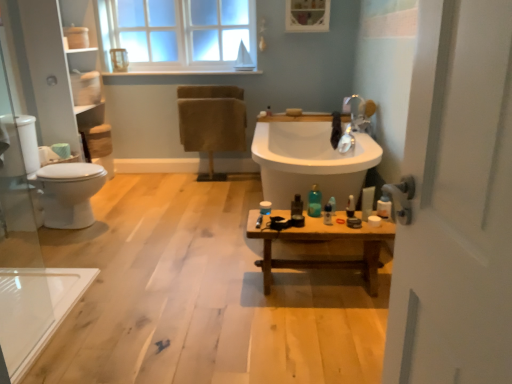
Locate an element on the screen. The height and width of the screenshot is (384, 512). vacant space behind wooden bench at center is located at coordinates (300, 253).